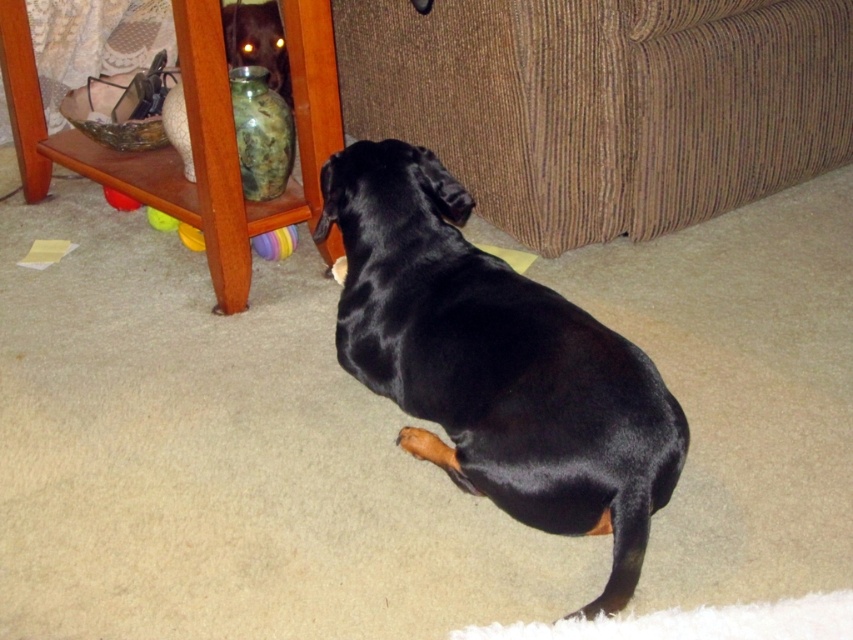
Question: Is the position of yellow rubber toy at lower left less distant than that of yellow rubber ball at lower left?

Choices:
 (A) no
 (B) yes

Answer: (B)

Question: Which point is farther from the camera taking this photo?

Choices:
 (A) (189, 241)
 (B) (109, 193)
 (C) (155, 209)

Answer: (B)

Question: Estimate the real-world distances between objects in this image. Which object is closer to the black shiny dog at center?

Choices:
 (A) brown corduroy couch at upper right
 (B) shiny black dog at center

Answer: (A)

Question: Among these points, which one is farthest from the camera?

Choices:
 (A) (717, 13)
 (B) (260, 252)
 (C) (178, 225)

Answer: (C)

Question: Where is shiny black dog at center located in relation to multicolored rubber ball at lower center in the image?

Choices:
 (A) left
 (B) right

Answer: (A)

Question: Does black shiny dog at center appear under yellow rubber toy at lower left?

Choices:
 (A) yes
 (B) no

Answer: (A)